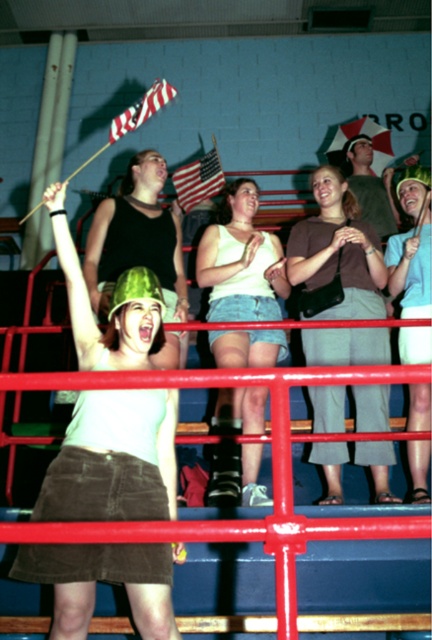
You are a photographer standing at the back of the bleachers. You want to take a photo of the matte green helmet at center and the denim shorts at center so that both are clearly visible. Considering their distance apart, is there a risk that one might be out of focus if you focus on the other?

The matte green helmet at center is 38.27 inches away from denim shorts at center. If you focus on one, the other may be slightly out of focus due to the distance between them, so it might be better to adjust your focus or use a smaller aperture for greater depth of field.

You are a photographer at the event and want to capture a photo that includes both the matte green helmet at center and the matte green helmet at upper right. Which helmet should you focus on first to ensure both are in the frame?

The matte green helmet at upper right should be focused on first since it is above the matte green helmet at center, allowing the photographer to frame both by starting with the higher one.

You are a photographer at the event and want to capture a photo where the matte green helmet at center and denim shorts at center are both visible. Based on their positions, which object should be placed closer to the bottom of the photo?

The matte green helmet at center should be placed closer to the bottom of the photo because it is below the denim shorts at center.